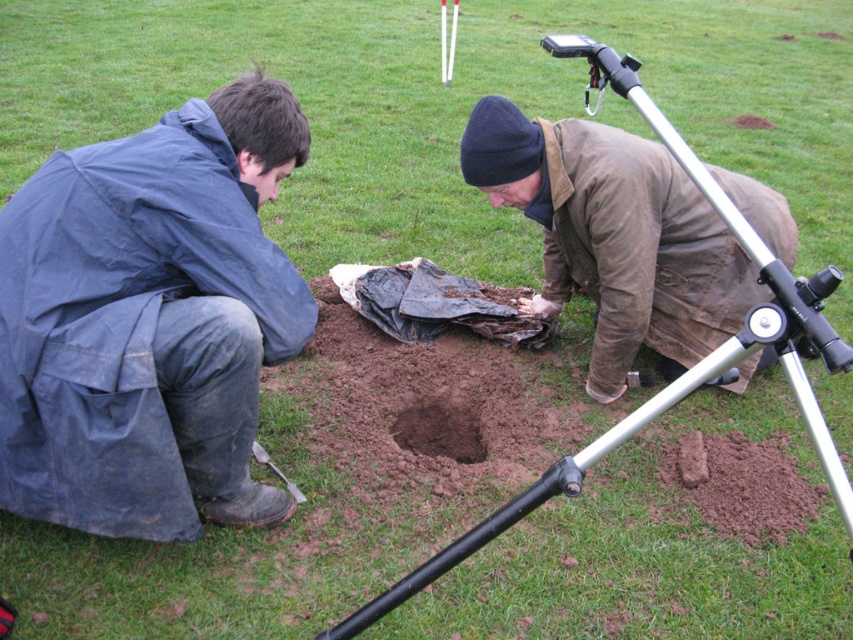
Who is more forward, (234, 486) or (637, 84)?

Point (637, 84) is in front.

Is point (244, 241) behind point (604, 67)?

Yes, point (244, 241) is farther from viewer.

Is point (170, 323) in front of point (548, 49)?

No, (170, 323) is further to viewer.

I want to click on blue waterproof jacket at left, so (x=149, y=321).

Does point (459, 445) come in front of point (599, 97)?

Yes, it is in front of point (599, 97).

Does point (425, 444) come behind point (544, 45)?

That is False.

Locate an element on the screen. The image size is (853, 640). brown dirt hole at center is located at coordinates (440, 429).

Is brown leather jacket at center to the right of brown dirt hole at center from the viewer's perspective?

Indeed, brown leather jacket at center is positioned on the right side of brown dirt hole at center.

Is brown leather jacket at center further to the viewer compared to brown dirt hole at center?

No, brown leather jacket at center is closer to the viewer.

Between point (682, 316) and point (479, 454), which one is positioned in front?

Point (682, 316) is more forward.

This screenshot has width=853, height=640. I want to click on brown leather jacket at center, so click(x=614, y=236).